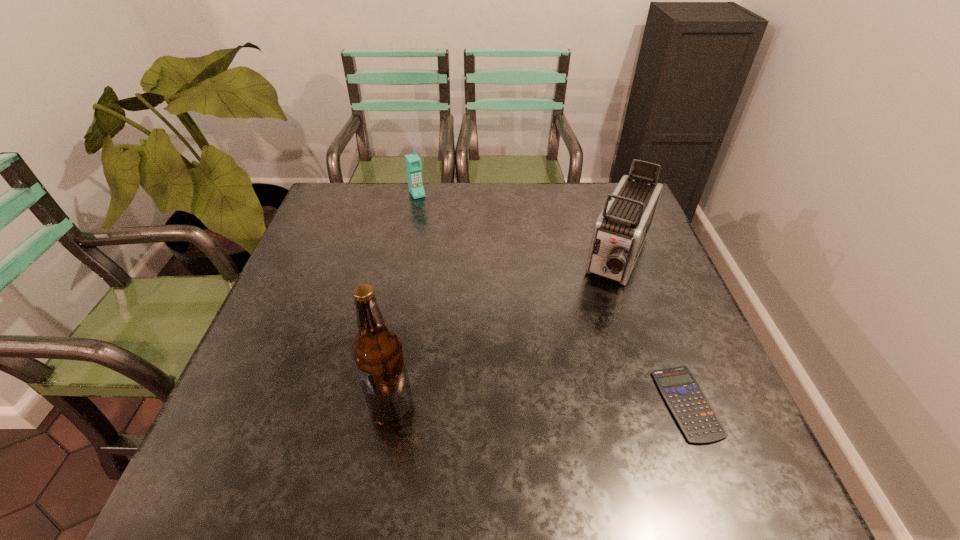
Locate an element on the screen. The image size is (960, 540). blank area located at the lens of the second tallest object is located at coordinates (582, 362).

In order to click on free space located 0.260m at the lens of the second tallest object in this screenshot , I will do `click(577, 372)`.

Locate an element on the screen. The width and height of the screenshot is (960, 540). free space located at the lens of the second tallest object is located at coordinates (562, 406).

In order to click on vacant space located on the keypad of the cellular telephone in this screenshot , I will do `click(462, 265)`.

Find the location of a particular element. This screenshot has width=960, height=540. free region located 0.290m on the keypad of the cellular telephone is located at coordinates (454, 252).

The width and height of the screenshot is (960, 540). Find the location of `vacant area situated on the keypad of the cellular telephone`. vacant area situated on the keypad of the cellular telephone is located at coordinates (452, 250).

Locate an element on the screen. Image resolution: width=960 pixels, height=540 pixels. camcorder that is at the far edge is located at coordinates (620, 231).

The height and width of the screenshot is (540, 960). What are the coordinates of `cellular telephone located at the far edge` in the screenshot? It's located at (413, 162).

Image resolution: width=960 pixels, height=540 pixels. What are the coordinates of `beer bottle that is at the near edge` in the screenshot? It's located at (377, 350).

Where is `calculator present at the near edge`? The image size is (960, 540). calculator present at the near edge is located at coordinates (692, 410).